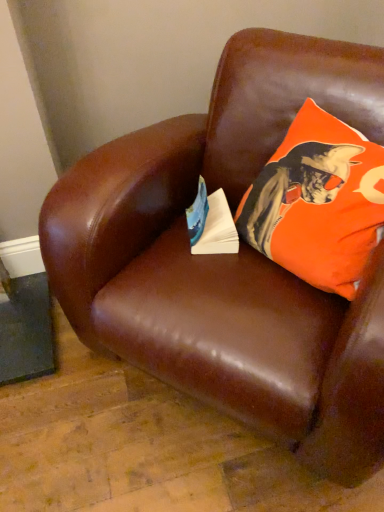
What do you see at coordinates (211, 223) in the screenshot? I see `white paper at center` at bounding box center [211, 223].

This screenshot has height=512, width=384. In order to click on white paper at center in this screenshot , I will do `click(211, 223)`.

Identify the location of orange fabric pillow at upper right. This screenshot has height=512, width=384. (318, 202).

This screenshot has width=384, height=512. Describe the element at coordinates (318, 202) in the screenshot. I see `orange fabric pillow at upper right` at that location.

Locate an element on the screen. The width and height of the screenshot is (384, 512). white paper at center is located at coordinates (211, 223).

Looking at this image, considering the positions of objects orange fabric pillow at upper right and white paper at center in the image provided, who is more to the right, orange fabric pillow at upper right or white paper at center?

orange fabric pillow at upper right is more to the right.

Which is in front, orange fabric pillow at upper right or white paper at center?

orange fabric pillow at upper right is in front.

Is point (326, 291) behind point (221, 195)?

That is False.

From the image's perspective, is orange fabric pillow at upper right under white paper at center?

No.

From a real-world perspective, is orange fabric pillow at upper right positioned above or below white paper at center?

From a real-world perspective, orange fabric pillow at upper right is physically above white paper at center.

Is orange fabric pillow at upper right wider or thinner than white paper at center?

In the image, orange fabric pillow at upper right appears to be wider than white paper at center.

Considering the relative sizes of orange fabric pillow at upper right and white paper at center in the image provided, is orange fabric pillow at upper right shorter than white paper at center?

In fact, orange fabric pillow at upper right may be taller than white paper at center.

Who is smaller, orange fabric pillow at upper right or white paper at center?

Smaller between the two is white paper at center.

Is orange fabric pillow at upper right completely or partially outside of white paper at center?

Indeed, orange fabric pillow at upper right is completely outside white paper at center.

Is orange fabric pillow at upper right not near white paper at center?

No, orange fabric pillow at upper right is not far away from white paper at center.

Could you tell me if orange fabric pillow at upper right is turned towards white paper at center?

Yes, orange fabric pillow at upper right is aimed at white paper at center.

Measure the distance from orange fabric pillow at upper right to white paper at center.

orange fabric pillow at upper right is 8.21 inches from white paper at center.

Where is `paperback book below the orange fabric pillow at upper right (from the image's perspective)`? This screenshot has height=512, width=384. paperback book below the orange fabric pillow at upper right (from the image's perspective) is located at coordinates (211, 223).

Between white paper at center and orange fabric pillow at upper right, which one appears on the left side from the viewer's perspective?

white paper at center is more to the left.

Is white paper at center further to camera compared to orange fabric pillow at upper right?

Yes.

Does point (223, 225) appear closer or farther from the camera than point (303, 149)?

Point (223, 225) is positioned farther from the camera compared to point (303, 149).

From the image's perspective, would you say white paper at center is positioned over orange fabric pillow at upper right?

No, from the image's perspective, white paper at center is not on top of orange fabric pillow at upper right.

From a real-world perspective, is white paper at center above or below orange fabric pillow at upper right?

Clearly, from a real-world perspective, white paper at center is below orange fabric pillow at upper right.

Looking at this image, between white paper at center and orange fabric pillow at upper right, which one has smaller width?

Thinner between the two is white paper at center.

Is white paper at center shorter than orange fabric pillow at upper right?

Yes.

Which of these two, white paper at center or orange fabric pillow at upper right, is smaller?

Smaller between the two is white paper at center.

Do you think white paper at center is within orange fabric pillow at upper right, or outside of it?

The correct answer is: outside.

Is white paper at center directly adjacent to orange fabric pillow at upper right?

They are not placed beside each other.

Is white paper at center looking in the opposite direction of orange fabric pillow at upper right?

Correct, white paper at center is looking away from orange fabric pillow at upper right.

What's the angular difference between white paper at center and orange fabric pillow at upper right's facing directions?

62.7 degrees separate the facing orientations of white paper at center and orange fabric pillow at upper right.

Measure the distance between white paper at center and orange fabric pillow at upper right.

white paper at center is 8.21 inches from orange fabric pillow at upper right.

Locate an element on the screen. The image size is (384, 512). pillow above the white paper at center (from a real-world perspective) is located at coordinates (318, 202).

The height and width of the screenshot is (512, 384). In order to click on paperback book behind the orange fabric pillow at upper right in this screenshot , I will do `click(211, 223)`.

Locate an element on the screen. pillow located in front of the white paper at center is located at coordinates (318, 202).